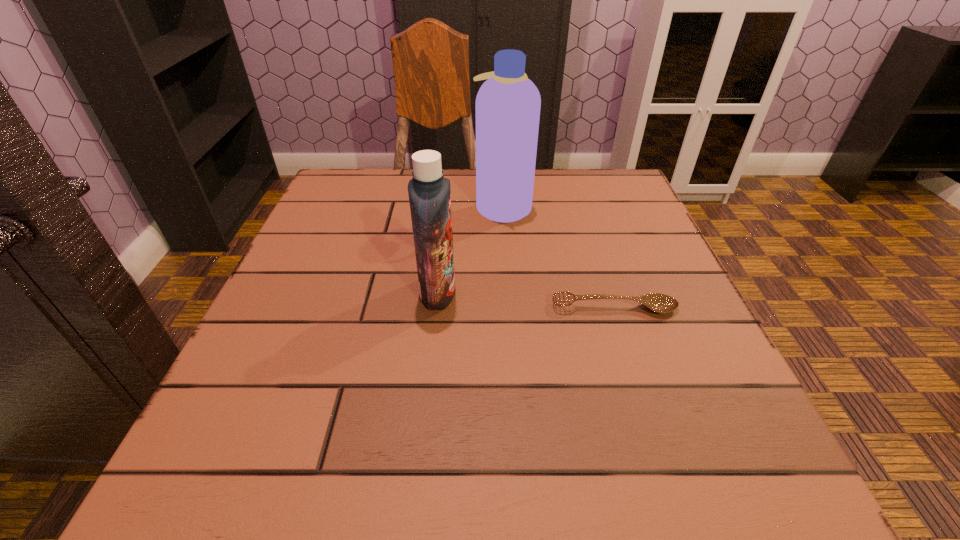
Locate an element on the screen. object positioned at the right edge is located at coordinates (660, 303).

Find the location of `vacant area at the far edge of the desktop`. vacant area at the far edge of the desktop is located at coordinates (571, 220).

Find the location of a particular element. The width and height of the screenshot is (960, 540). vacant space at the near edge of the desktop is located at coordinates (384, 457).

Identify the location of vacant region at the left edge. This screenshot has height=540, width=960. (352, 311).

Identify the location of free region at the right edge of the desktop. This screenshot has width=960, height=540. (697, 336).

You are a GUI agent. You are given a task and a screenshot of the screen. Output one action in this format:
    pyautogui.click(x=<x>, y=<y>)
    Task: Click on the free location at the far left corner
    
    Given the screenshot: What is the action you would take?
    pyautogui.click(x=377, y=186)

Locate an element on the screen. vacant region at the far right corner is located at coordinates (619, 207).

Locate an element on the screen. This screenshot has height=540, width=960. free space at the near right corner is located at coordinates (660, 476).

I want to click on vacant space that's between the shorter shampoo and the shortest object, so click(526, 300).

The height and width of the screenshot is (540, 960). Find the location of `empty space between the right shampoo and the rightmost object`. empty space between the right shampoo and the rightmost object is located at coordinates (559, 257).